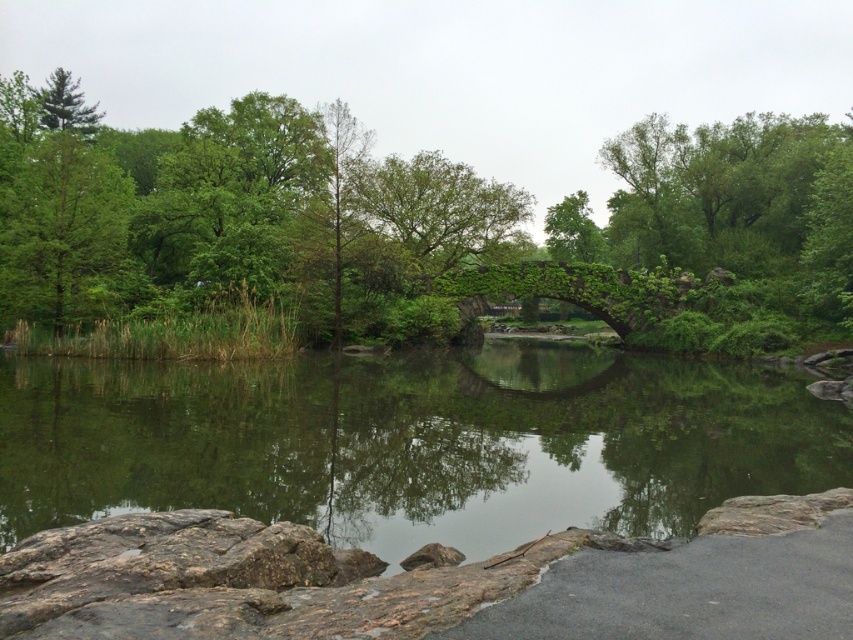
You are standing at the rocky edge leading into the water and want to walk towards the green leafy tree at left and the green leafy tree at upper left. Which tree will you reach first?

You will reach the green leafy tree at left first because it is closer to you than the green leafy tree at upper left.

You are standing at the edge of the water and want to take a photo of the green leafy tree at left. If your camera has a maximum zoom range of 100 feet, will you be able to capture the entire tree in the photo without moving closer?

The green leafy tree at left is 107.17 feet from viewer. Since the camera can only zoom up to 100 feet, you won

You are standing on the stone bridge and looking down at the scene. Which object, the green leafy tree at center or the green reflective water at center, is positioned higher from your viewpoint?

The green leafy tree at center is located above the green reflective water at center, so it is positioned higher from your viewpoint.